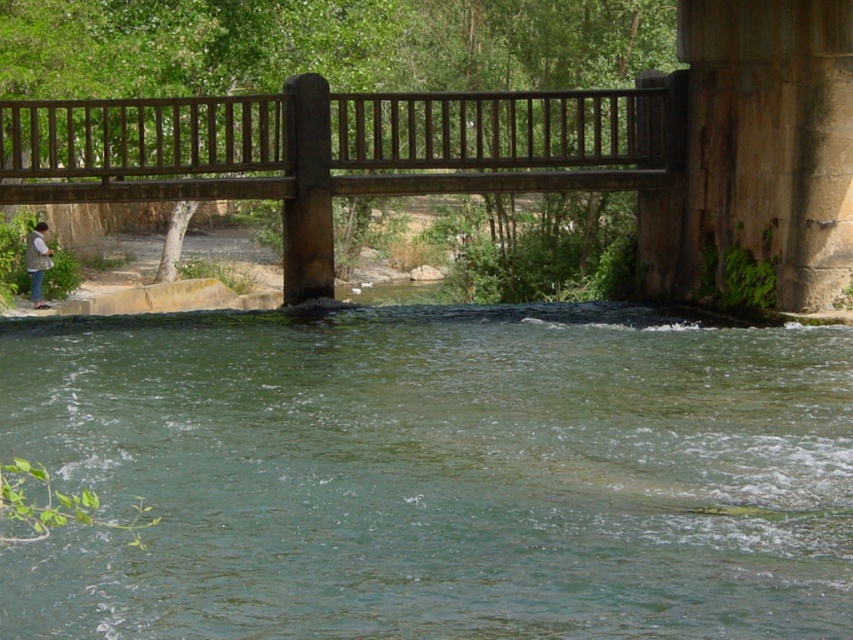
Is brown wooden bridge at upper center to the left of denim jacket at lower left from the viewer's perspective?

Incorrect, brown wooden bridge at upper center is not on the left side of denim jacket at lower left.

Is brown wooden bridge at upper center thinner than denim jacket at lower left?

No, brown wooden bridge at upper center is not thinner than denim jacket at lower left.

Where is `brown wooden bridge at upper center`? This screenshot has width=853, height=640. brown wooden bridge at upper center is located at coordinates (340, 150).

Who is more distant from viewer, (x=750, y=564) or (x=39, y=136)?

The point (x=39, y=136) is more distant.

The image size is (853, 640). Find the location of `clear water at center`. clear water at center is located at coordinates (434, 474).

Is clear water at center thinner than denim jacket at lower left?

No, clear water at center is not thinner than denim jacket at lower left.

The image size is (853, 640). Find the location of `clear water at center`. clear water at center is located at coordinates (434, 474).